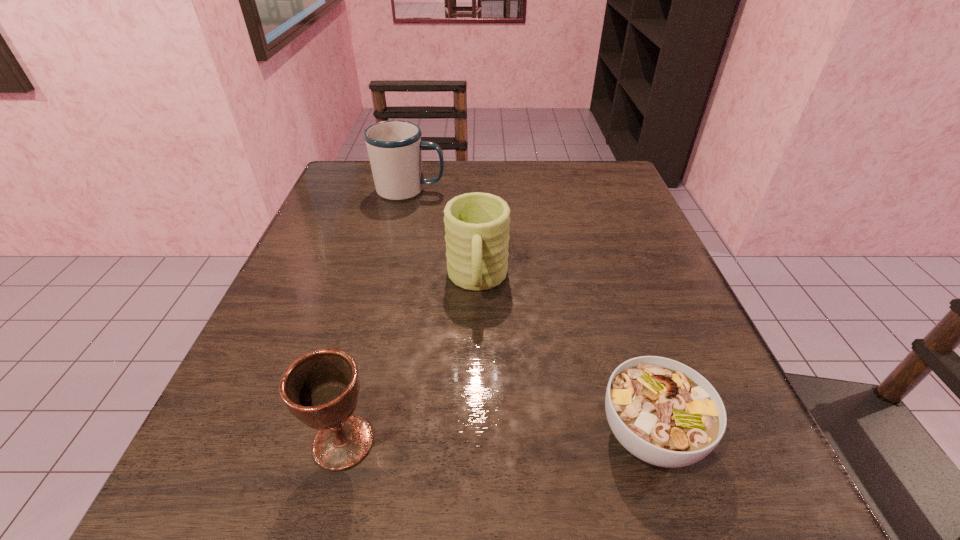
The height and width of the screenshot is (540, 960). I want to click on free space at the far edge of the desktop, so click(x=498, y=166).

I want to click on vacant space at the near edge of the desktop, so click(x=449, y=468).

Where is `vacant space at the left edge`? vacant space at the left edge is located at coordinates (330, 244).

Locate an element on the screen. This screenshot has height=540, width=960. blank space at the right edge is located at coordinates (621, 301).

The width and height of the screenshot is (960, 540). I want to click on blank space at the far left corner of the desktop, so click(x=381, y=201).

The height and width of the screenshot is (540, 960). In the image, there is a desktop. In order to click on vacant space at the near left corner in this screenshot , I will do `click(271, 481)`.

At what (x,y) coordinates should I click in order to perform the action: click on vacant region at the far right corner of the desktop. Please return your answer as a coordinate pair (x, y). This screenshot has height=540, width=960. Looking at the image, I should click on (568, 172).

You are a GUI agent. You are given a task and a screenshot of the screen. Output one action in this format:
    pyautogui.click(x=<x>, y=<y>)
    Task: Click on the free space at the near right corner of the desktop
    This screenshot has height=540, width=960.
    Given the screenshot: What is the action you would take?
    pyautogui.click(x=653, y=518)

Identify the location of free point between the left mug and the chalice. The image size is (960, 540). (376, 316).

This screenshot has width=960, height=540. I want to click on vacant region between the chalice and the second object from right to left, so pyautogui.click(x=410, y=361).